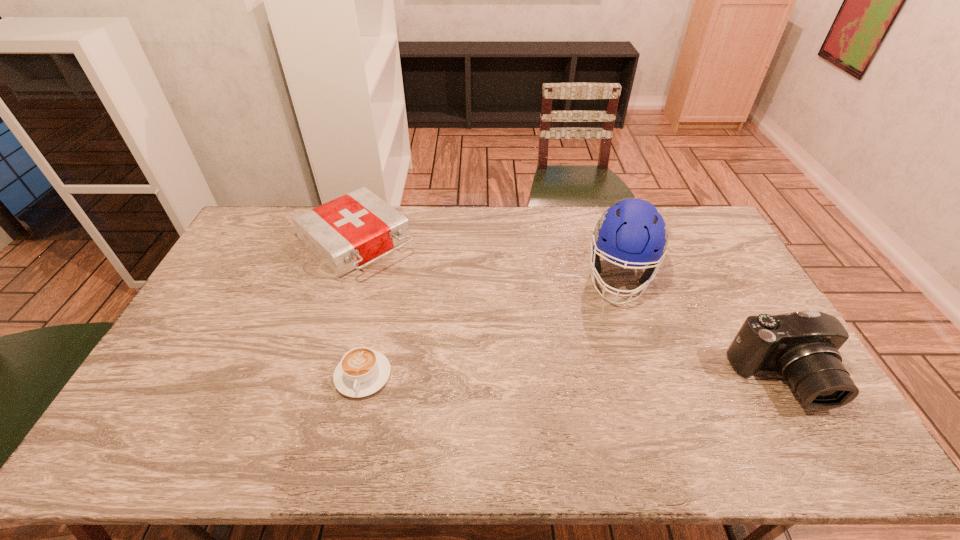
The width and height of the screenshot is (960, 540). I want to click on vacant space located 0.330m on the front side of the third tallest object, so click(x=455, y=328).

At what (x,y) coordinates should I click in order to perform the action: click on vacant space situated on the front side of the third tallest object. Please return your answer as a coordinate pair (x, y). This screenshot has width=960, height=540. Looking at the image, I should click on (430, 306).

You are a GUI agent. You are given a task and a screenshot of the screen. Output one action in this format:
    pyautogui.click(x=<x>, y=<y>)
    Task: Click on the object located at the far edge
    
    Given the screenshot: What is the action you would take?
    pyautogui.click(x=347, y=232)

At what (x,y) coordinates should I click in order to perform the action: click on cappuccino that is at the near edge. Please return your answer as a coordinate pair (x, y). This screenshot has width=960, height=540. Looking at the image, I should click on (362, 371).

At what (x,y) coordinates should I click in order to perform the action: click on camera present at the near edge. Please return your answer as a coordinate pair (x, y). This screenshot has height=540, width=960. Looking at the image, I should click on (802, 346).

Where is `object at the right edge`? The height and width of the screenshot is (540, 960). object at the right edge is located at coordinates (802, 346).

Where is `object that is at the near right corner`? Image resolution: width=960 pixels, height=540 pixels. object that is at the near right corner is located at coordinates (802, 346).

Identify the location of free space at the far edge of the desktop. (426, 225).

At what (x,y) coordinates should I click in order to perform the action: click on vacant space at the near edge. Please return your answer as a coordinate pair (x, y). Image resolution: width=960 pixels, height=540 pixels. Looking at the image, I should click on (220, 388).

Where is `free region at the left edge`? Image resolution: width=960 pixels, height=540 pixels. free region at the left edge is located at coordinates (249, 251).